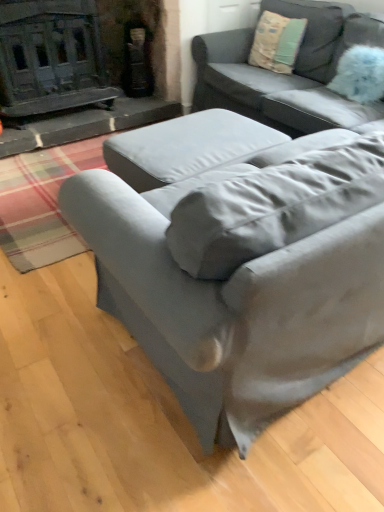
In order to face satin gray couch at lower right, which is counted as the 2th studio couch, starting from the back, should I rotate leftwards or rightwards?

It's best to rotate right around 13.940 degrees.

Measure the distance between satin gray couch at lower right, which is counted as the 2th studio couch, starting from the back, and camera.

satin gray couch at lower right, which is counted as the 2th studio couch, starting from the back, and camera are 86.05 centimeters apart from each other.

Describe the element at coordinates (277, 42) in the screenshot. I see `textured beige pillow at upper right` at that location.

Where is `satin gray couch at center, the second studio couch when ordered from front to back`? This screenshot has height=512, width=384. satin gray couch at center, the second studio couch when ordered from front to back is located at coordinates (287, 75).

You are a GUI agent. You are given a task and a screenshot of the screen. Output one action in this format:
    pyautogui.click(x=<x>, y=<y>)
    Task: Click on the satin gray couch at lower right, which is counted as the 2th studio couch, starting from the back
    The height and width of the screenshot is (512, 384).
    Given the screenshot: What is the action you would take?
    pyautogui.click(x=238, y=259)

What are the coordinates of `studio couch that is the 2nd one when counting forward from the textured beige pillow at upper right` in the screenshot? It's located at (238, 259).

Is satin gray couch at lower right, which is the 1th studio couch from front to back, in front of or behind textured beige pillow at upper right in the image?

In the image, satin gray couch at lower right, which is the 1th studio couch from front to back, appears in front of textured beige pillow at upper right.

Measure the distance from satin gray couch at lower right, which is the 1th studio couch from front to back, to textured beige pillow at upper right.

satin gray couch at lower right, which is the 1th studio couch from front to back, is 1.98 meters from textured beige pillow at upper right.

Is textured beige pillow at upper right surrounded by satin gray couch at lower right, which is counted as the 2th studio couch, starting from the back?

No, satin gray couch at lower right, which is counted as the 2th studio couch, starting from the back, does not contain textured beige pillow at upper right.

From the image's perspective, is satin gray couch at center, the second studio couch when ordered from front to back, above satin gray couch at lower right, which is the 1th studio couch from front to back?

Yes.

In the scene shown: Which is correct: satin gray couch at center, the second studio couch when ordered from front to back, is inside satin gray couch at lower right, which is counted as the 2th studio couch, starting from the back, or outside of it?

The correct answer is: outside.

Is satin gray couch at center, positioned as the first studio couch in back-to-front order, thinner than satin gray couch at lower right, which is the 1th studio couch from front to back?

Indeed, satin gray couch at center, positioned as the first studio couch in back-to-front order, has a lesser width compared to satin gray couch at lower right, which is the 1th studio couch from front to back.

Which object is positioned more to the left, satin gray couch at center, the second studio couch when ordered from front to back, or satin gray couch at lower right, which is the 1th studio couch from front to back?

satin gray couch at lower right, which is the 1th studio couch from front to back, is more to the left.

Is point (314, 98) positioned in front of point (378, 99)?

No, it is behind (378, 99).

Does satin gray couch at center, positioned as the first studio couch in back-to-front order, have a greater width compared to blue fluffy pillow at upper right?

Correct, the width of satin gray couch at center, positioned as the first studio couch in back-to-front order, exceeds that of blue fluffy pillow at upper right.

Is satin gray couch at center, the second studio couch when ordered from front to back, positioned far away from blue fluffy pillow at upper right?

satin gray couch at center, the second studio couch when ordered from front to back, is actually quite close to blue fluffy pillow at upper right.

Which is correct: blue fluffy pillow at upper right is inside textured beige pillow at upper right, or outside of it?

blue fluffy pillow at upper right is not enclosed by textured beige pillow at upper right.

You are a GUI agent. You are given a task and a screenshot of the screen. Output one action in this format:
    pyautogui.click(x=<x>, y=<y>)
    Task: Click on the pillow that is below the textured beige pillow at upper right (from the image's perspective)
    The height and width of the screenshot is (512, 384).
    Given the screenshot: What is the action you would take?
    pyautogui.click(x=360, y=74)

Between blue fluffy pillow at upper right and textured beige pillow at upper right, which one is positioned behind?

textured beige pillow at upper right is behind.

Is blue fluffy pillow at upper right oriented away from textured beige pillow at upper right?

That's not correct — blue fluffy pillow at upper right is not looking away from textured beige pillow at upper right.

Looking at this image, from a real-world perspective, which is physically above, blue fluffy pillow at upper right or satin gray couch at center, the second studio couch when ordered from front to back?

In real-world perspective, blue fluffy pillow at upper right is above.

Based on the photo, in terms of height, does blue fluffy pillow at upper right look taller or shorter compared to satin gray couch at center, the second studio couch when ordered from front to back?

In the image, blue fluffy pillow at upper right appears to be shorter than satin gray couch at center, the second studio couch when ordered from front to back.

Does blue fluffy pillow at upper right appear on the right side of satin gray couch at center, positioned as the first studio couch in back-to-front order?

Yes, blue fluffy pillow at upper right is to the right of satin gray couch at center, positioned as the first studio couch in back-to-front order.

Does blue fluffy pillow at upper right touch satin gray couch at center, positioned as the first studio couch in back-to-front order?

blue fluffy pillow at upper right and satin gray couch at center, positioned as the first studio couch in back-to-front order, are not in contact.

Which object is more forward, textured beige pillow at upper right or satin gray couch at center, positioned as the first studio couch in back-to-front order?

satin gray couch at center, positioned as the first studio couch in back-to-front order, is closer to the camera.

Considering the relative sizes of textured beige pillow at upper right and satin gray couch at center, the second studio couch when ordered from front to back, in the image provided, is textured beige pillow at upper right wider than satin gray couch at center, the second studio couch when ordered from front to back,?

No, textured beige pillow at upper right is not wider than satin gray couch at center, the second studio couch when ordered from front to back.

Between textured beige pillow at upper right and satin gray couch at center, the second studio couch when ordered from front to back, which one has larger size?

Bigger between the two is satin gray couch at center, the second studio couch when ordered from front to back.

Is textured beige pillow at upper right far away from satin gray couch at center, the second studio couch when ordered from front to back?

No, textured beige pillow at upper right is not far from satin gray couch at center, the second studio couch when ordered from front to back.

From a real-world perspective, is textured beige pillow at upper right above or below satin gray couch at lower right, which is counted as the 2th studio couch, starting from the back?

textured beige pillow at upper right is above satin gray couch at lower right, which is counted as the 2th studio couch, starting from the back.

Looking at this image, is textured beige pillow at upper right positioned far away from satin gray couch at lower right, which is counted as the 2th studio couch, starting from the back?

That's right, there is a large distance between textured beige pillow at upper right and satin gray couch at lower right, which is counted as the 2th studio couch, starting from the back.

Locate an element on the screen. The height and width of the screenshot is (512, 384). throw pillow above the satin gray couch at lower right, which is counted as the 2th studio couch, starting from the back (from a real-world perspective) is located at coordinates (277, 42).

At what (x,y) coordinates should I click in order to perform the action: click on studio couch below the satin gray couch at center, the second studio couch when ordered from front to back (from the image's perspective). Please return your answer as a coordinate pair (x, y). The image size is (384, 512). Looking at the image, I should click on (238, 259).

Looking at the image, which one is located further to satin gray couch at center, positioned as the first studio couch in back-to-front order, blue fluffy pillow at upper right or textured beige pillow at upper right?

The object further to satin gray couch at center, positioned as the first studio couch in back-to-front order, is blue fluffy pillow at upper right.

Looking at the image, which one is located further to satin gray couch at lower right, which is the 1th studio couch from front to back, textured beige pillow at upper right or blue fluffy pillow at upper right?

The object further to satin gray couch at lower right, which is the 1th studio couch from front to back, is textured beige pillow at upper right.

Which object lies further to the anchor point blue fluffy pillow at upper right, textured beige pillow at upper right or satin gray couch at center, positioned as the first studio couch in back-to-front order?

The object further to blue fluffy pillow at upper right is textured beige pillow at upper right.

Considering their positions, is satin gray couch at center, the second studio couch when ordered from front to back, positioned further to textured beige pillow at upper right than blue fluffy pillow at upper right?

The object further to textured beige pillow at upper right is blue fluffy pillow at upper right.

Looking at the image, which one is located closer to textured beige pillow at upper right, satin gray couch at lower right, which is the 1th studio couch from front to back, or blue fluffy pillow at upper right?

blue fluffy pillow at upper right.

Looking at the image, which one is located closer to textured beige pillow at upper right, satin gray couch at lower right, which is counted as the 2th studio couch, starting from the back, or satin gray couch at center, the second studio couch when ordered from front to back?

satin gray couch at center, the second studio couch when ordered from front to back, is positioned closer to the anchor textured beige pillow at upper right.

Based on their spatial positions, is blue fluffy pillow at upper right or satin gray couch at lower right, which is counted as the 2th studio couch, starting from the back, further from textured beige pillow at upper right?

satin gray couch at lower right, which is counted as the 2th studio couch, starting from the back.

Estimate the real-world distances between objects in this image. Which object is further from satin gray couch at lower right, which is counted as the 2th studio couch, starting from the back, satin gray couch at center, positioned as the first studio couch in back-to-front order, or blue fluffy pillow at upper right?

Based on the image, blue fluffy pillow at upper right appears to be further to satin gray couch at lower right, which is counted as the 2th studio couch, starting from the back.

Identify the location of studio couch positioned between satin gray couch at lower right, which is counted as the 2th studio couch, starting from the back, and textured beige pillow at upper right from near to far. This screenshot has height=512, width=384. (287, 75).

Find the location of a particular element. studio couch located between satin gray couch at lower right, which is counted as the 2th studio couch, starting from the back, and blue fluffy pillow at upper right in the depth direction is located at coordinates (287, 75).

Locate an element on the screen. pillow located between satin gray couch at center, positioned as the first studio couch in back-to-front order, and textured beige pillow at upper right in the depth direction is located at coordinates (360, 74).

Identify the location of pillow between satin gray couch at lower right, which is the 1th studio couch from front to back, and textured beige pillow at upper right in the front-back direction. (360, 74).